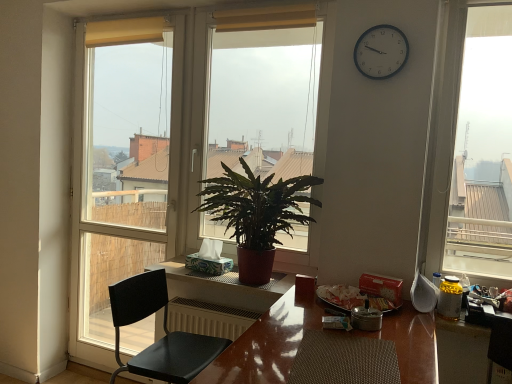
Question: From the image's perspective, is glossy wooden table at center, acting as the 2th table starting from the back, under yellow fabric curtain at upper center, which is counted as the 2th curtain, starting from the right?

Choices:
 (A) no
 (B) yes

Answer: (B)

Question: Is the position of glossy wooden table at center, which is the 2th table in top-to-bottom order, less distant than that of yellow fabric curtain at upper center, which is counted as the 2th curtain, starting from the right?

Choices:
 (A) no
 (B) yes

Answer: (B)

Question: From a real-world perspective, is glossy wooden table at center, which is the 2th table in top-to-bottom order, under yellow fabric curtain at upper center, acting as the 1th curtain starting from the left?

Choices:
 (A) yes
 (B) no

Answer: (A)

Question: Can you confirm if glossy wooden table at center, which is the 2th table in top-to-bottom order, is positioned to the right of yellow fabric curtain at upper center, which is the 2th curtain in front-to-back order?

Choices:
 (A) no
 (B) yes

Answer: (B)

Question: From the image's perspective, is glossy wooden table at center, acting as the 2th table starting from the back, over yellow fabric curtain at upper center, acting as the 1th curtain starting from the left?

Choices:
 (A) yes
 (B) no

Answer: (B)

Question: Is matte glass window at center, which appears as the first window when viewed from the right, situated inside white plastic clock at upper right or outside?

Choices:
 (A) inside
 (B) outside

Answer: (B)

Question: From the image's perspective, is matte glass window at center, which appears as the first window when viewed from the right, above or below white plastic clock at upper right?

Choices:
 (A) below
 (B) above

Answer: (A)

Question: Considering the positions of matte glass window at center, which appears as the first window when viewed from the right, and white plastic clock at upper right in the image, is matte glass window at center, which appears as the first window when viewed from the right, taller or shorter than white plastic clock at upper right?

Choices:
 (A) tall
 (B) short

Answer: (A)

Question: Is matte glass window at center, the second window in the left-to-right sequence, wider or thinner than white plastic clock at upper right?

Choices:
 (A) thin
 (B) wide

Answer: (B)

Question: Considering the positions of glossy wooden table at center, which is the 2th table in top-to-bottom order, and yellow fabric curtain at upper center, marked as the 2th curtain in a back-to-front arrangement, in the image, is glossy wooden table at center, which is the 2th table in top-to-bottom order, wider or thinner than yellow fabric curtain at upper center, marked as the 2th curtain in a back-to-front arrangement,?

Choices:
 (A) wide
 (B) thin

Answer: (A)

Question: Is point (286, 360) closer or farther from the camera than point (284, 28)?

Choices:
 (A) closer
 (B) farther

Answer: (A)

Question: From a real-world perspective, is glossy wooden table at center, acting as the 2th table starting from the back, physically located above or below yellow fabric curtain at upper center, placed as the second curtain when sorted from left to right?

Choices:
 (A) above
 (B) below

Answer: (B)

Question: Visually, is glossy wooden table at center, the 1th table from the bottom, positioned to the left or to the right of yellow fabric curtain at upper center, which ranks as the first curtain in front-to-back order?

Choices:
 (A) left
 (B) right

Answer: (B)

Question: From the image's perspective, is yellow fabric curtain at upper center, which is counted as the 2th curtain, starting from the right, positioned above or below glossy wooden table at center, which is the 2th table in top-to-bottom order?

Choices:
 (A) above
 (B) below

Answer: (A)

Question: Considering their positions, is yellow fabric curtain at upper center, which is counted as the 2th curtain, starting from the right, located in front of or behind glossy wooden table at center, acting as the 2th table starting from the back?

Choices:
 (A) behind
 (B) front

Answer: (A)